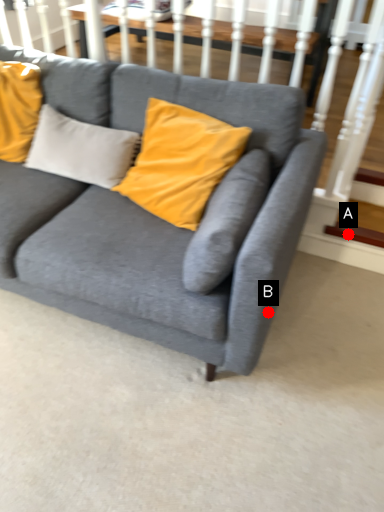
Question: Two points are circled on the image, labeled by A and B beside each circle. Which point is further to the camera?

Choices:
 (A) A is further
 (B) B is further

Answer: (A)